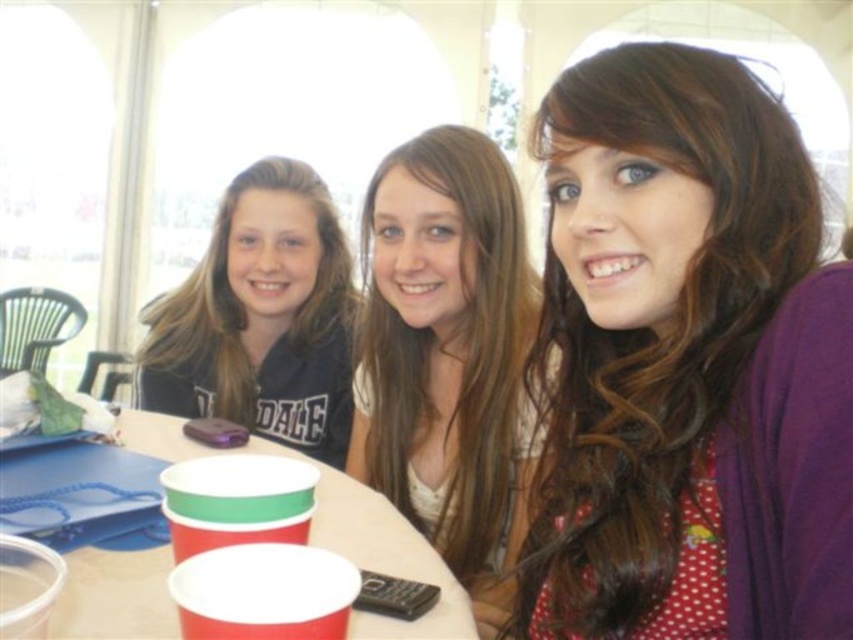
You are at a party and want to grab a drink. There are two red paper cups in front of you. One is the red paper cup at lower center and the other is the red paper cup at center. Which one is closer to you?

The red paper cup at lower center is closer to you since it is only 4.00 inches away from the red paper cup at center.

You are holding a 15 inch long ruler and want to measure the distance between yourself and the purple fabric at center. Can you reach it without moving your hand?

The purple fabric at center is 16.79 inches away from viewer, so the 15 inch ruler cannot reach it without moving your hand.

You are a photographer adjusting the camera focus. The smooth white shirt at center and the red paper cup at lower center are both in the frame. Which object should you focus on first if you want to ensure the larger object is sharp?

The smooth white shirt at center is bigger than the red paper cup at lower center, so you should focus on the smooth white shirt at center first to ensure the larger object is sharp.